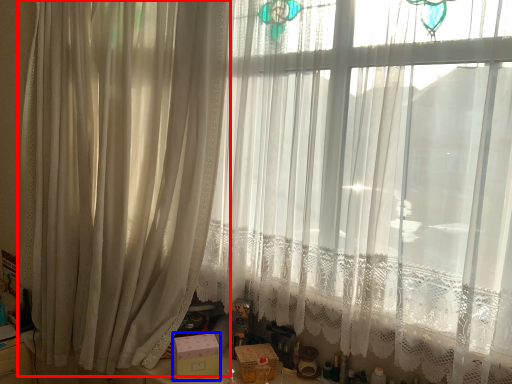
Question: Which point is closer to the camera, curtain (highlighted by a red box) or box (highlighted by a blue box)?

Choices:
 (A) curtain
 (B) box

Answer: (A)